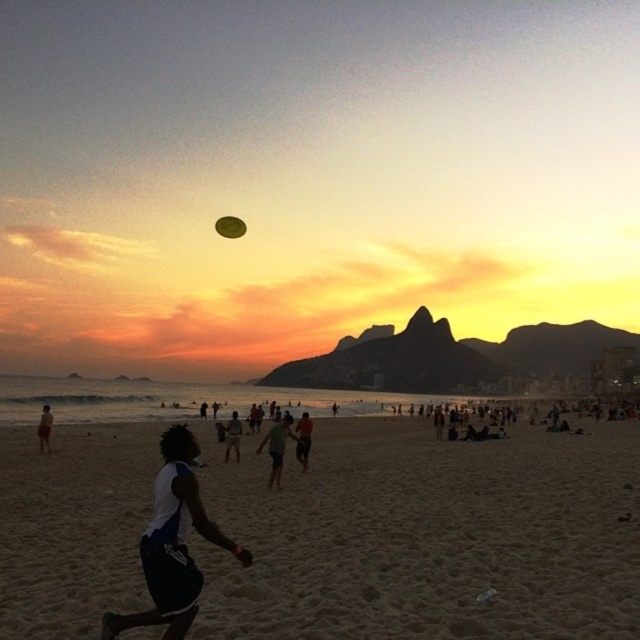
Can you confirm if light green fabric shirt at center is positioned to the left of dark blue shorts at center?

Incorrect, light green fabric shirt at center is not on the left side of dark blue shorts at center.

Does light green fabric shirt at center have a smaller size compared to dark blue shorts at center?

Actually, light green fabric shirt at center might be larger than dark blue shorts at center.

Which is behind, point (300, 460) or point (237, 440)?

The point (237, 440) is behind.

This screenshot has height=640, width=640. I want to click on light green fabric shirt at center, so click(x=304, y=440).

Who is lower down, sandy beach at center or dark blue shorts at center?

Positioned lower is sandy beach at center.

Is sandy beach at center to the left of dark blue shorts at center from the viewer's perspective?

In fact, sandy beach at center is to the right of dark blue shorts at center.

Image resolution: width=640 pixels, height=640 pixels. What do you see at coordinates (428, 536) in the screenshot?
I see `sandy beach at center` at bounding box center [428, 536].

You are a GUI agent. You are given a task and a screenshot of the screen. Output one action in this format:
    pyautogui.click(x=<x>, y=<y>)
    Task: Click on the sandy beach at center
    
    Given the screenshot: What is the action you would take?
    pyautogui.click(x=428, y=536)

Between point (237, 436) and point (220, 232), which one is positioned in front?

Point (237, 436) is in front.

Can you confirm if dark blue shorts at center is bigger than green matte frisbee at center?

No.

Image resolution: width=640 pixels, height=640 pixels. What do you see at coordinates (232, 436) in the screenshot?
I see `dark blue shorts at center` at bounding box center [232, 436].

You are a GUI agent. You are given a task and a screenshot of the screen. Output one action in this format:
    pyautogui.click(x=<x>, y=<y>)
    Task: Click on the dark blue shorts at center
    
    Given the screenshot: What is the action you would take?
    pyautogui.click(x=232, y=436)